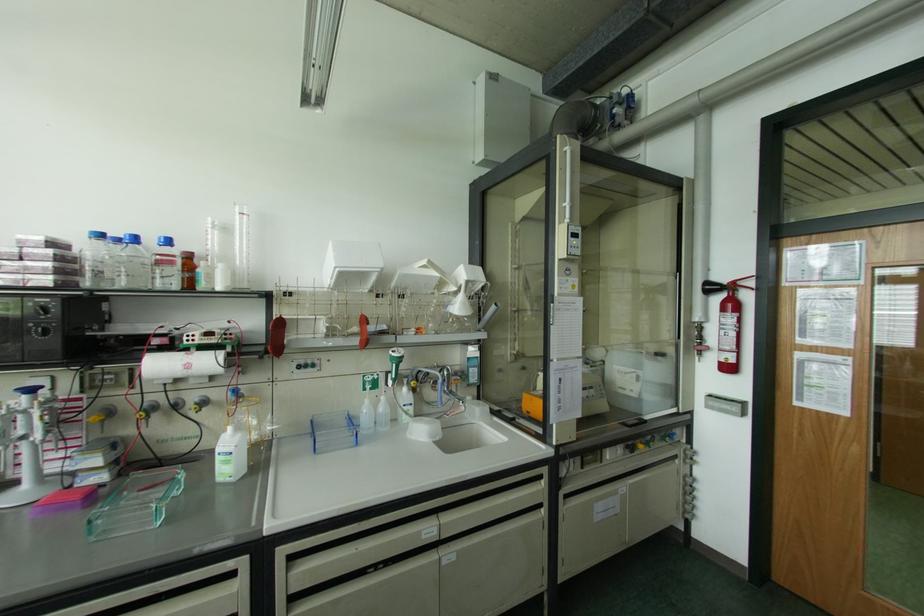
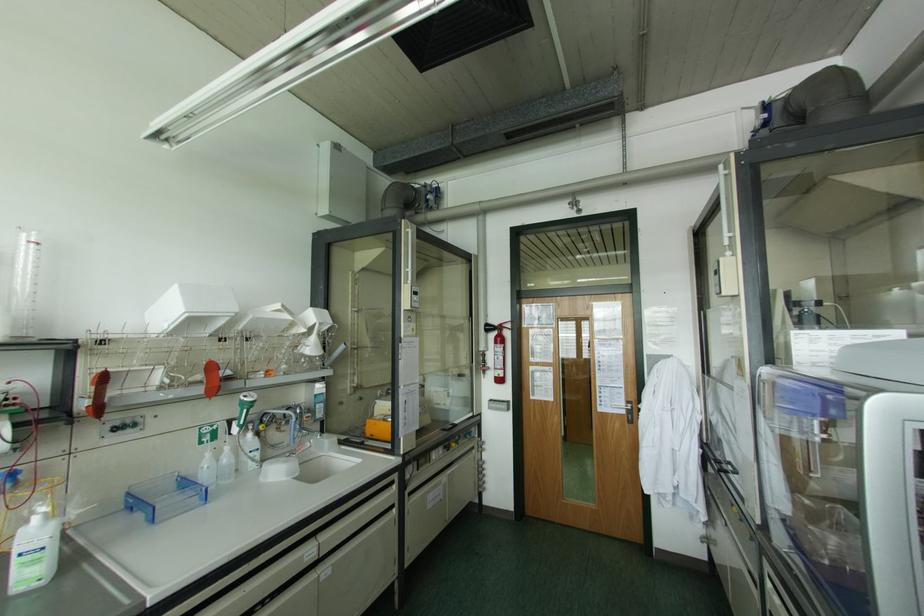
Find the pixel in the second image that matches point 750,283 in the first image.

(507, 325)